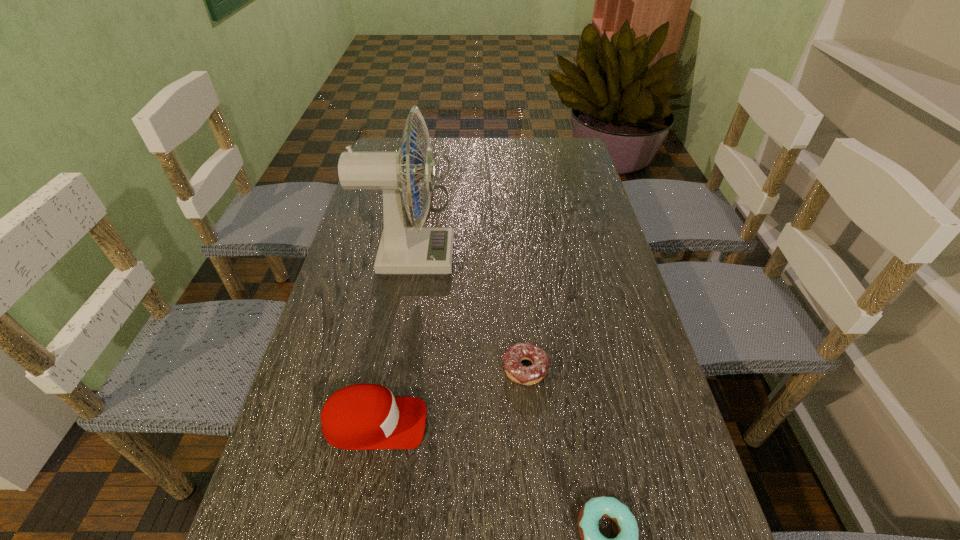
The height and width of the screenshot is (540, 960). What are the coordinates of `vacant space situated 0.160m on the front-facing side of the fourth farthest object` in the screenshot? It's located at (509, 423).

Locate an element on the screen. This screenshot has height=540, width=960. free region located 0.250m on the back of the fourth tallest object is located at coordinates (517, 273).

The width and height of the screenshot is (960, 540). I want to click on fan that is at the left edge, so click(402, 250).

Locate an element on the screen. The image size is (960, 540). mug at the left edge is located at coordinates (438, 153).

Find the location of a particular element. baseball cap present at the left edge is located at coordinates (362, 416).

Find the location of a particular element. This screenshot has width=960, height=540. vacant space at the far edge of the desktop is located at coordinates (514, 141).

The image size is (960, 540). In order to click on free location at the left edge in this screenshot , I will do `click(372, 285)`.

In the image, there is a desktop. At what (x,y) coordinates should I click in order to perform the action: click on vacant space at the right edge. Please return your answer as a coordinate pair (x, y). The image size is (960, 540). Looking at the image, I should click on (706, 515).

Image resolution: width=960 pixels, height=540 pixels. Identify the location of free space between the second tallest object and the baseball cap. (401, 303).

Find the location of a particular element. The width and height of the screenshot is (960, 540). vacant area that lies between the left doughnut and the farthest object is located at coordinates (476, 276).